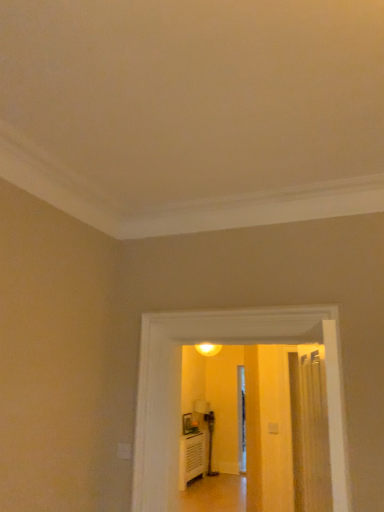
Question: Would you say smooth beige carpet at center is outside wooden floor at lower center?

Choices:
 (A) yes
 (B) no

Answer: (A)

Question: Are smooth beige carpet at center and wooden floor at lower center located far from each other?

Choices:
 (A) no
 (B) yes

Answer: (B)

Question: Is the depth of smooth beige carpet at center greater than that of wooden floor at lower center?

Choices:
 (A) yes
 (B) no

Answer: (B)

Question: Is smooth beige carpet at center at the left side of wooden floor at lower center?

Choices:
 (A) no
 (B) yes

Answer: (B)

Question: From the image's perspective, is smooth beige carpet at center below wooden floor at lower center?

Choices:
 (A) yes
 (B) no

Answer: (B)

Question: Can you confirm if smooth beige carpet at center is wider than wooden floor at lower center?

Choices:
 (A) yes
 (B) no

Answer: (B)

Question: Is wooden floor at lower center in front of smooth beige carpet at center?

Choices:
 (A) yes
 (B) no

Answer: (B)

Question: Considering the relative sizes of wooden floor at lower center and smooth beige carpet at center in the image provided, is wooden floor at lower center shorter than smooth beige carpet at center?

Choices:
 (A) no
 (B) yes

Answer: (B)

Question: From the image's perspective, would you say wooden floor at lower center is positioned over smooth beige carpet at center?

Choices:
 (A) no
 (B) yes

Answer: (A)

Question: Considering the relative sizes of wooden floor at lower center and smooth beige carpet at center in the image provided, is wooden floor at lower center thinner than smooth beige carpet at center?

Choices:
 (A) no
 (B) yes

Answer: (A)

Question: From a real-world perspective, does wooden floor at lower center stand above smooth beige carpet at center?

Choices:
 (A) no
 (B) yes

Answer: (A)

Question: Are wooden floor at lower center and smooth beige carpet at center located far from each other?

Choices:
 (A) no
 (B) yes

Answer: (B)

Question: Is wooden floor at lower center taller or shorter than smooth beige carpet at center?

Choices:
 (A) short
 (B) tall

Answer: (A)